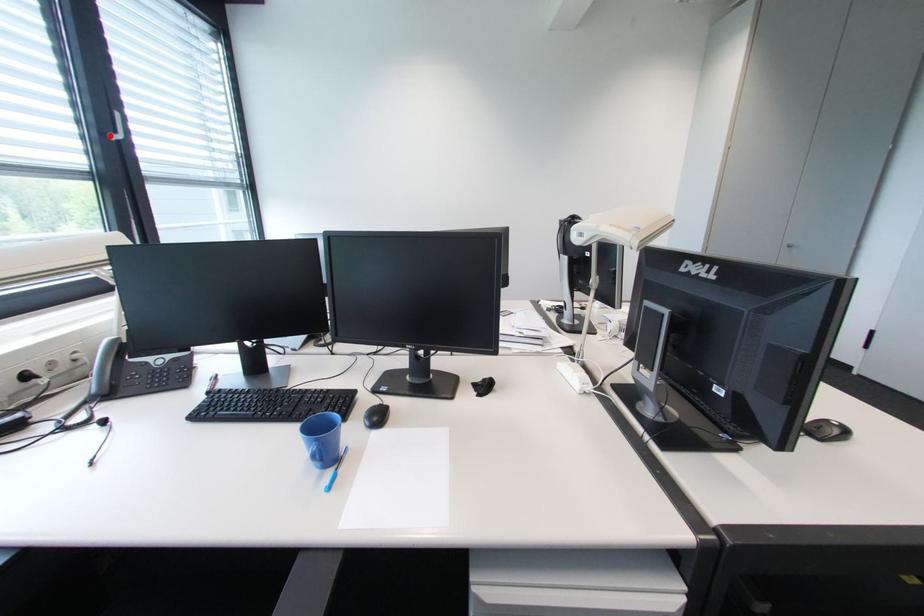
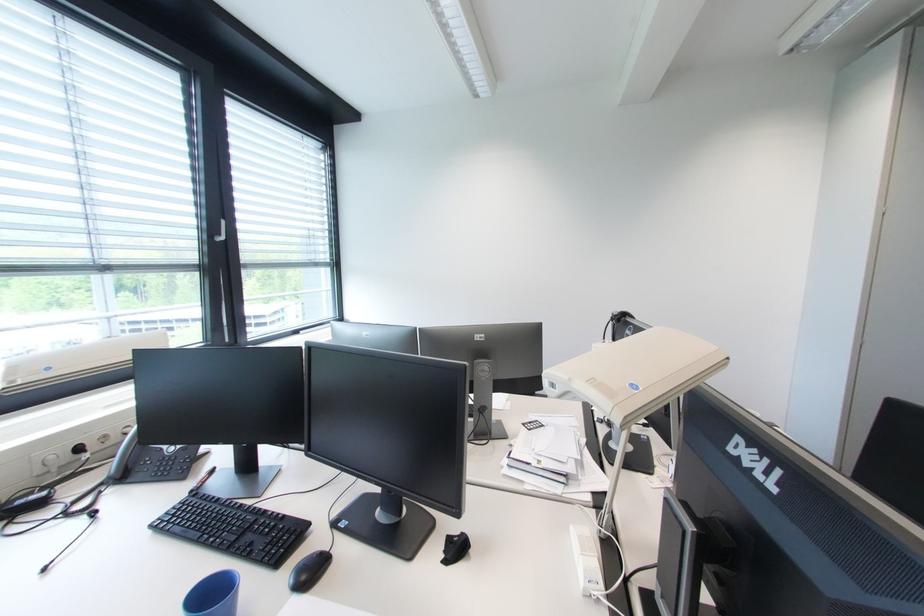
The point at the highlighted location is marked in the first image. Where is the corresponding point in the second image?

(217, 238)